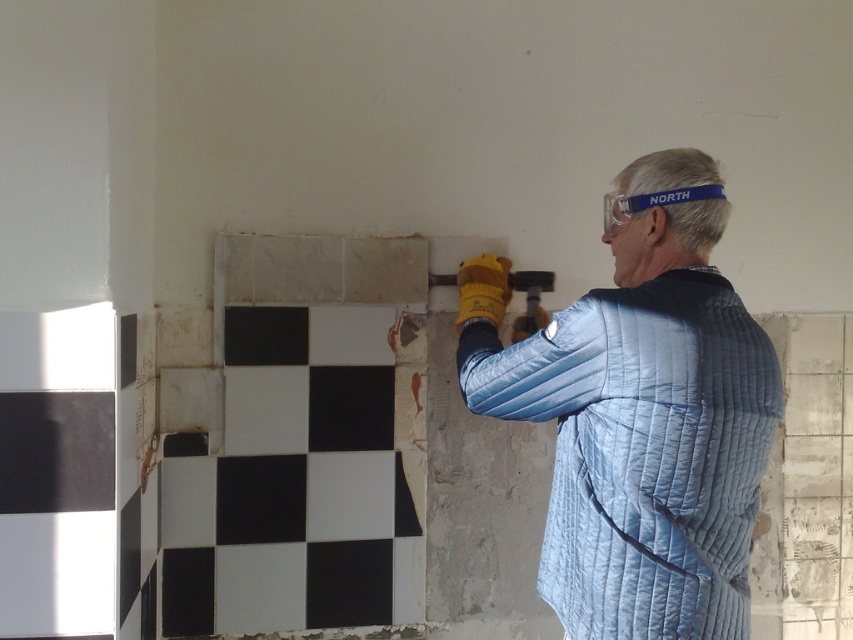
Does blue quilted jacket at center appear on the left side of black matte tile at center?

In fact, blue quilted jacket at center is to the right of black matte tile at center.

Is blue quilted jacket at center positioned in front of black matte tile at center?

Yes, blue quilted jacket at center is in front of black matte tile at center.

Who is more forward, [735,520] or [248,472]?

Point [735,520]

Identify the location of blue quilted jacket at center. (645, 419).